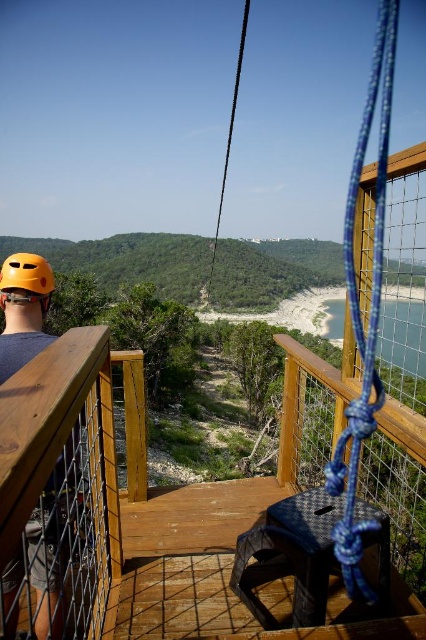
You are standing on the wooden platform and want to place a small flag on the object that is shorter between the wooden at upper center and the matte yellow helmet at left. Which object should you choose?

The wooden at upper center has a lesser height compared to the matte yellow helmet at left, so you should place the flag on the wooden at upper center.

From the picture: You are a safety inspector checking the equipment on the wooden platform. You notice two yellow matte helmets. Which one is positioned lower between the matte yellow helmet at left and the yellow matte helmet at upper left?

The matte yellow helmet at left is positioned lower than the yellow matte helmet at upper left, as it is located below it.